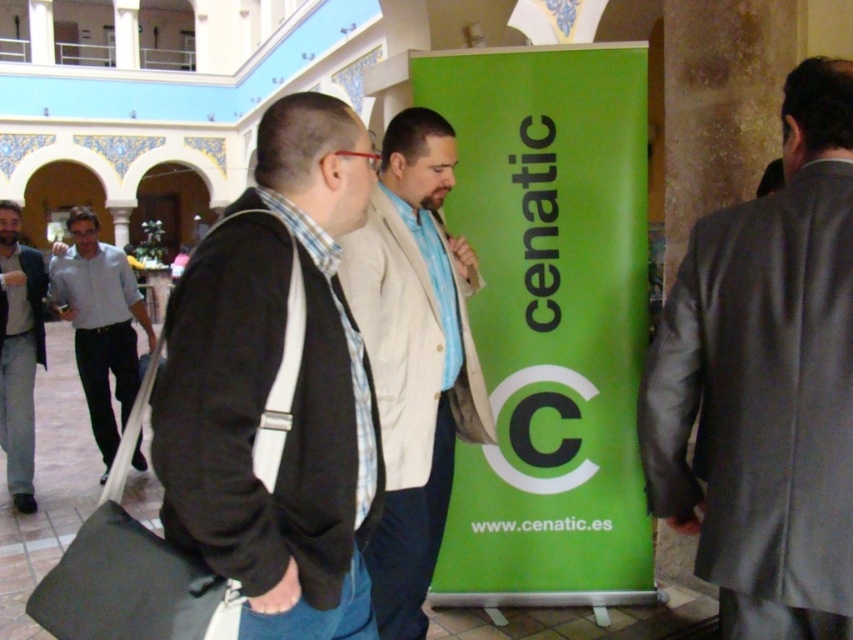
Is light beige jacket at center positioned behind white shirt at left?

No, light beige jacket at center is closer to the viewer.

Can you confirm if light beige jacket at center is shorter than white shirt at left?

Incorrect, light beige jacket at center's height does not fall short of white shirt at left's.

At what (x,y) coordinates should I click in order to perform the action: click on light beige jacket at center. Please return your answer as a coordinate pair (x, y). The height and width of the screenshot is (640, 853). Looking at the image, I should click on (415, 356).

Between light beige jacket at center and light blue shirt at left, which one appears on the left side from the viewer's perspective?

light blue shirt at left is more to the left.

Is point (392, 541) positioned before point (30, 298)?

That is True.

This screenshot has width=853, height=640. I want to click on light beige jacket at center, so click(415, 356).

This screenshot has width=853, height=640. Describe the element at coordinates (271, 384) in the screenshot. I see `dark gray sweater at center` at that location.

Is dark gray sweater at center wider than white shirt at left?

In fact, dark gray sweater at center might be narrower than white shirt at left.

Between point (241, 586) and point (93, 234), which one is positioned in front?

Point (241, 586)

You are a GUI agent. You are given a task and a screenshot of the screen. Output one action in this format:
    pyautogui.click(x=<x>, y=<y>)
    Task: Click on the dark gray sweater at center
    This screenshot has height=640, width=853.
    Given the screenshot: What is the action you would take?
    pyautogui.click(x=271, y=384)